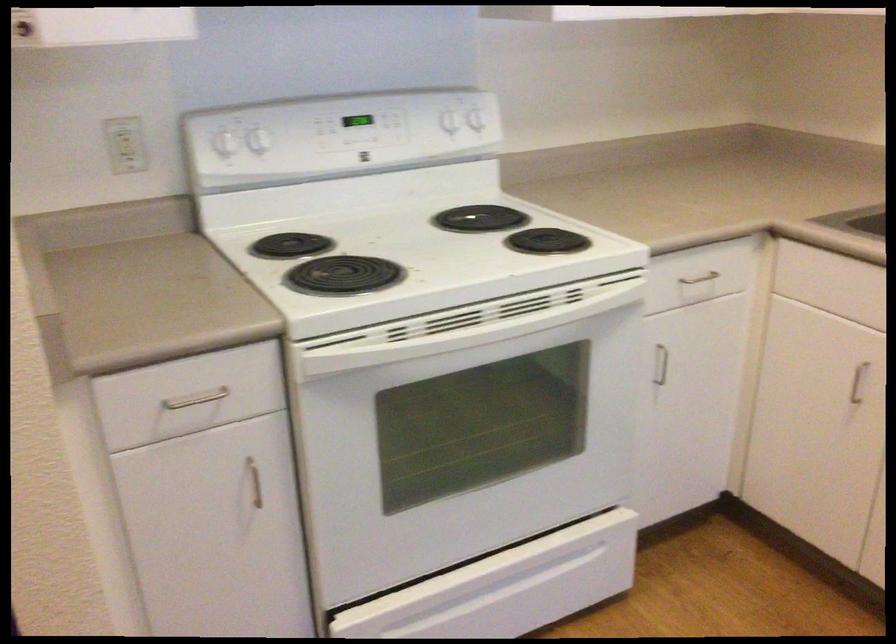
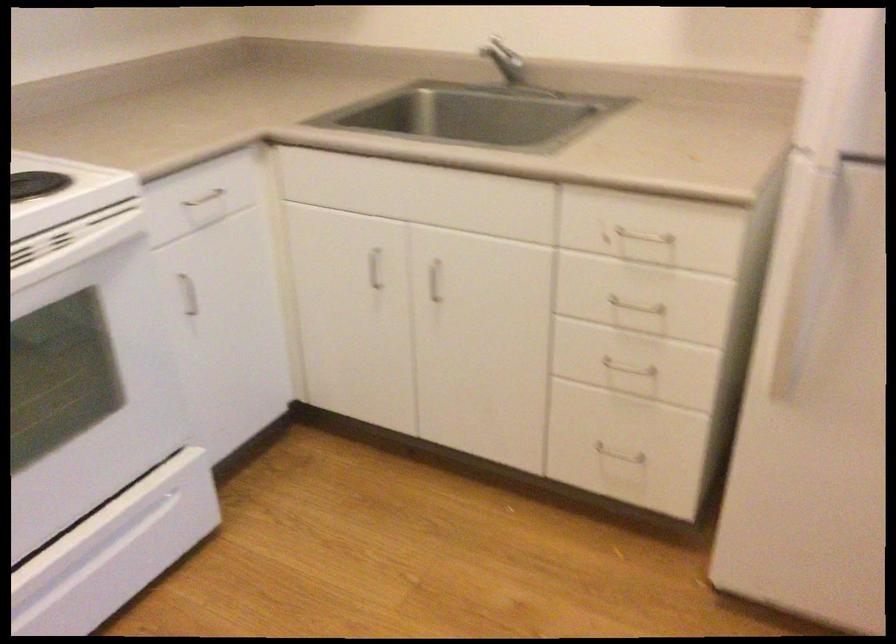
Question: Based on the continuous images, in which direction is the camera rotating? Reply with the corresponding letter.

Choices:
 (A) Left
 (B) Right
 (C) Up
 (D) Down

Answer: (B)